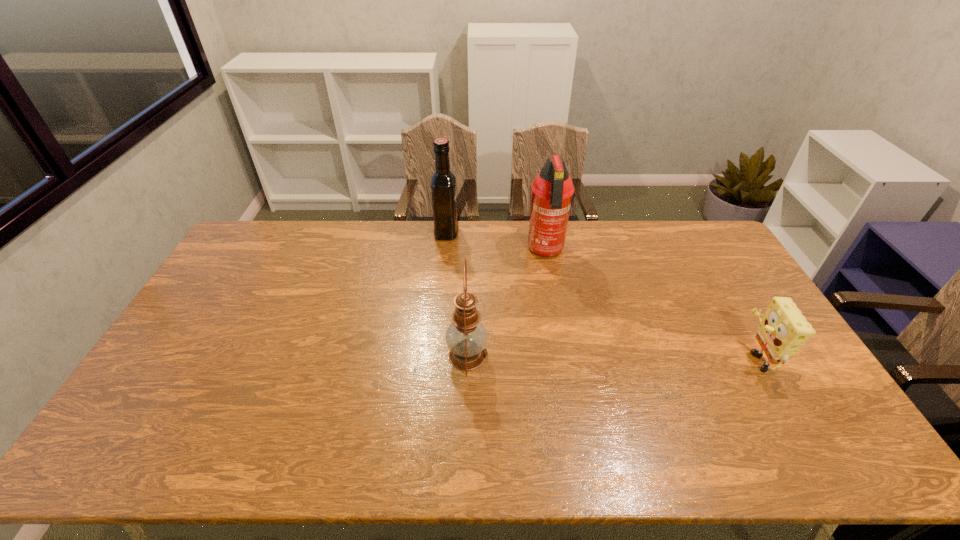
Locate an element on the screen. The image size is (960, 540). vacant area situated 0.210m on the face of the sponge is located at coordinates (666, 357).

The image size is (960, 540). I want to click on liquor at the far edge, so click(x=443, y=181).

Locate an element on the screen. This screenshot has height=540, width=960. fire extinguisher that is positioned at the far edge is located at coordinates (552, 189).

Find the location of a particular element. The image size is (960, 540). object at the right edge is located at coordinates (783, 330).

I want to click on vacant area at the far edge, so click(x=494, y=242).

At what (x,y) coordinates should I click in order to perform the action: click on vacant region at the near edge. Please return your answer as a coordinate pair (x, y). The width and height of the screenshot is (960, 540). Looking at the image, I should click on (697, 454).

In the image, there is a desktop. Identify the location of free space at the left edge. (244, 264).

Where is `free space at the right edge of the desktop`? free space at the right edge of the desktop is located at coordinates (735, 337).

At what (x,y) coordinates should I click in order to perform the action: click on vacant region at the far left corner of the desktop. Please return your answer as a coordinate pair (x, y). Image resolution: width=960 pixels, height=540 pixels. Looking at the image, I should click on (283, 226).

Find the location of `vacant space at the far right corner of the desktop`. vacant space at the far right corner of the desktop is located at coordinates (695, 224).